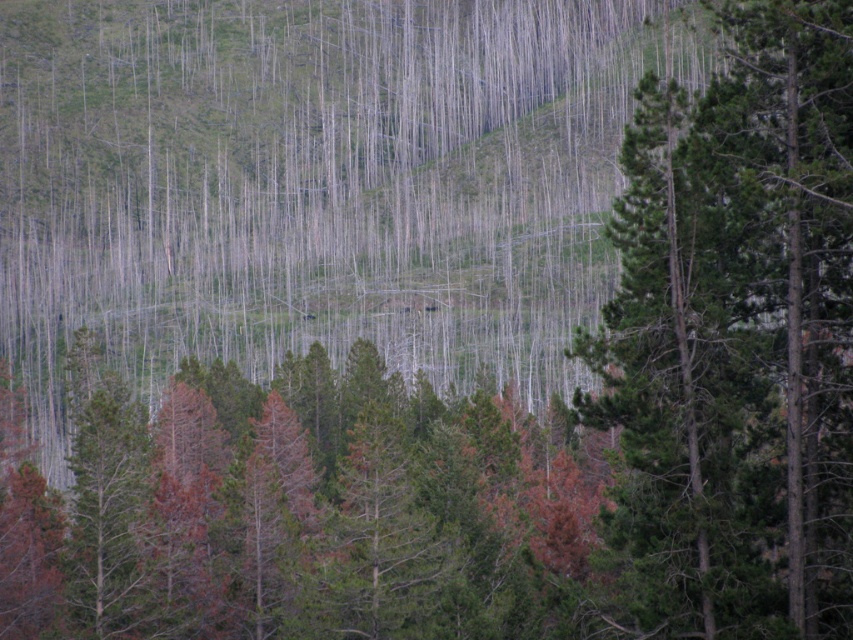
You are a hiker standing in the forest and see both the green matte tree at center and the green textured tree at center. Which one is positioned more to the left?

The green matte tree at center is positioned to the left of the green textured tree at center, so the green matte tree at center is more to the left.